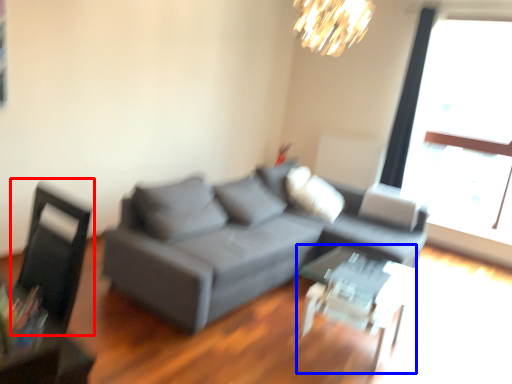
Question: Which of the following is the farthest to the observer, swivel chair (highlighted by a red box) or table (highlighted by a blue box)?

Choices:
 (A) swivel chair
 (B) table

Answer: (B)